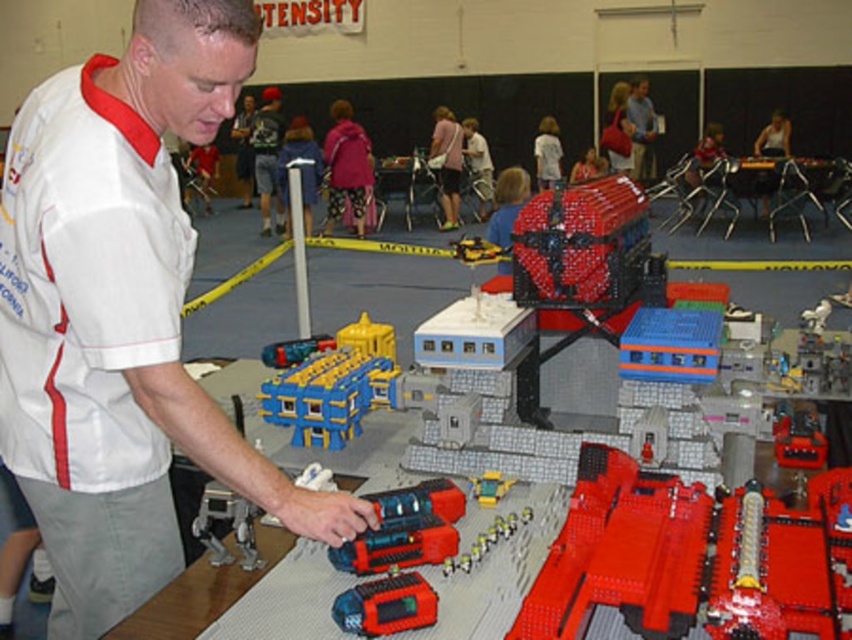
Consider the image. You are a photographer positioned at the entrance of the gymnasium. You need to capture a photo that includes both the white matte shirt at upper left and the blue plastic building at center. Given their relative sizes in the image, which object appears wider from your current viewpoint?

The white matte shirt at upper left appears wider than the blue plastic building at center because its width surpasses the latter according to the description.

You are a photographer at the LEGO event. You need to capture a photo that includes both the white matte shirt at upper left and the red plastic table at center. Which object should be placed closer to the camera to ensure both are in focus?

The white matte shirt at upper left is taller than the red plastic table at center, so to ensure both are in focus, the red plastic table at center should be placed closer to the camera.